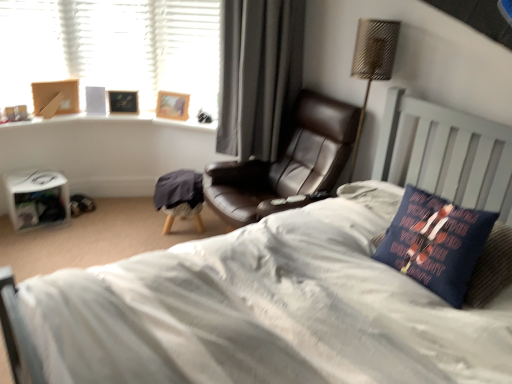
Question: Would you say wooden picture frame at upper left, acting as the second picture frame starting from the right, is part of metallic woven table lamp at upper right's contents?

Choices:
 (A) yes
 (B) no

Answer: (B)

Question: From the image's perspective, is metallic woven table lamp at upper right below wooden picture frame at upper left, acting as the second picture frame starting from the right?

Choices:
 (A) yes
 (B) no

Answer: (A)

Question: Can you confirm if metallic woven table lamp at upper right is positioned to the left of wooden picture frame at upper left, the 1th picture frame when ordered from left to right?

Choices:
 (A) yes
 (B) no

Answer: (B)

Question: Can you confirm if metallic woven table lamp at upper right is positioned to the right of wooden picture frame at upper left, the 1th picture frame when ordered from left to right?

Choices:
 (A) no
 (B) yes

Answer: (B)

Question: Is metallic woven table lamp at upper right smaller than wooden picture frame at upper left, the 1th picture frame when ordered from left to right?

Choices:
 (A) no
 (B) yes

Answer: (A)

Question: Would you say metallic woven table lamp at upper right is to the left or to the right of wooden picture frame at upper left, the second picture frame in the left-to-right sequence, in the picture?

Choices:
 (A) right
 (B) left

Answer: (A)

Question: Is metallic woven table lamp at upper right inside the boundaries of wooden picture frame at upper left, the second picture frame in the left-to-right sequence, or outside?

Choices:
 (A) outside
 (B) inside

Answer: (A)

Question: Is metallic woven table lamp at upper right bigger or smaller than wooden picture frame at upper left, marked as the first picture frame in a right-to-left arrangement?

Choices:
 (A) small
 (B) big

Answer: (B)

Question: From their relative heights in the image, would you say metallic woven table lamp at upper right is taller or shorter than wooden picture frame at upper left, marked as the first picture frame in a right-to-left arrangement?

Choices:
 (A) tall
 (B) short

Answer: (A)

Question: In terms of size, does wooden picture frame at upper left, the second picture frame in the left-to-right sequence, appear bigger or smaller than black leather chair at center?

Choices:
 (A) small
 (B) big

Answer: (A)

Question: From the image's perspective, relative to black leather chair at center, is wooden picture frame at upper left, marked as the first picture frame in a right-to-left arrangement, above or below?

Choices:
 (A) below
 (B) above

Answer: (A)

Question: In the image, is wooden picture frame at upper left, the second picture frame in the left-to-right sequence, positioned in front of or behind black leather chair at center?

Choices:
 (A) behind
 (B) front

Answer: (A)

Question: In terms of width, does wooden picture frame at upper left, marked as the first picture frame in a right-to-left arrangement, look wider or thinner when compared to black leather chair at center?

Choices:
 (A) wide
 (B) thin

Answer: (B)

Question: Looking at the image, does dark blue fabric pillow at right seem bigger or smaller compared to wooden picture frame at upper left, marked as the first picture frame in a right-to-left arrangement?

Choices:
 (A) big
 (B) small

Answer: (A)

Question: In terms of width, does dark blue fabric pillow at right look wider or thinner when compared to wooden picture frame at upper left, the second picture frame in the left-to-right sequence?

Choices:
 (A) thin
 (B) wide

Answer: (B)